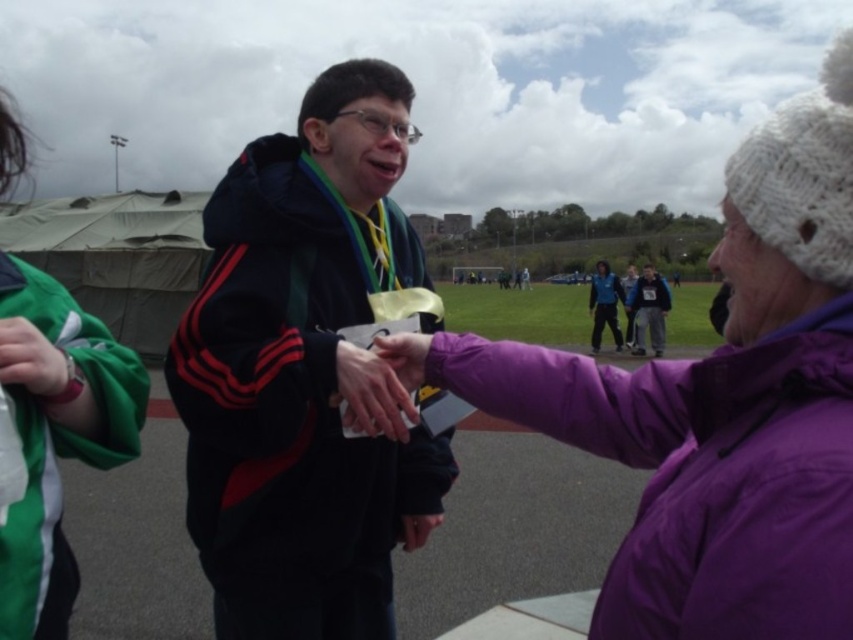
You are a photographer at the event and want to capture a photo of both the purple fleece jacket at center and the matte blue jacket at center. Based on their positions, which jacket is positioned to the left?

The purple fleece jacket at center is positioned to the left of the matte blue jacket at center.

You are a photographer at the event and need to position yourself so that both the purple fleece jacket at center and the matte blue jacket at center are fully visible in your shot. Given their heights, which jacket should you focus on to ensure the shorter one isn?t blocked?

The purple fleece jacket at center is shorter than the matte blue jacket at center. To ensure the shorter purple fleece jacket at center isn?t blocked, you should position yourself so that the taller matte blue jacket at center is not directly in front of it.

You are a photographer at the event and need to capture a photo that includes both the green fabric at left and the dark blue hoodie at center. The camera you are using has a maximum focus range of 15 meters. Will you be able to capture both objects in focus without moving the camera?

The distance between the green fabric at left and the dark blue hoodie at center is 15.42 meters. Since the camera can only focus up to 15 meters, it will not be able to capture both objects in focus without moving the camera.